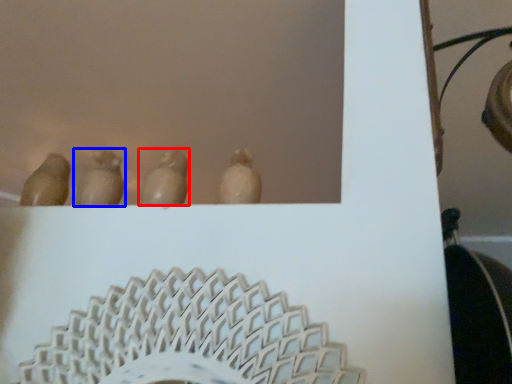
Question: Which object appears farthest to the camera in this image, animal (highlighted by a red box) or animal (highlighted by a blue box)?

Choices:
 (A) animal
 (B) animal

Answer: (B)